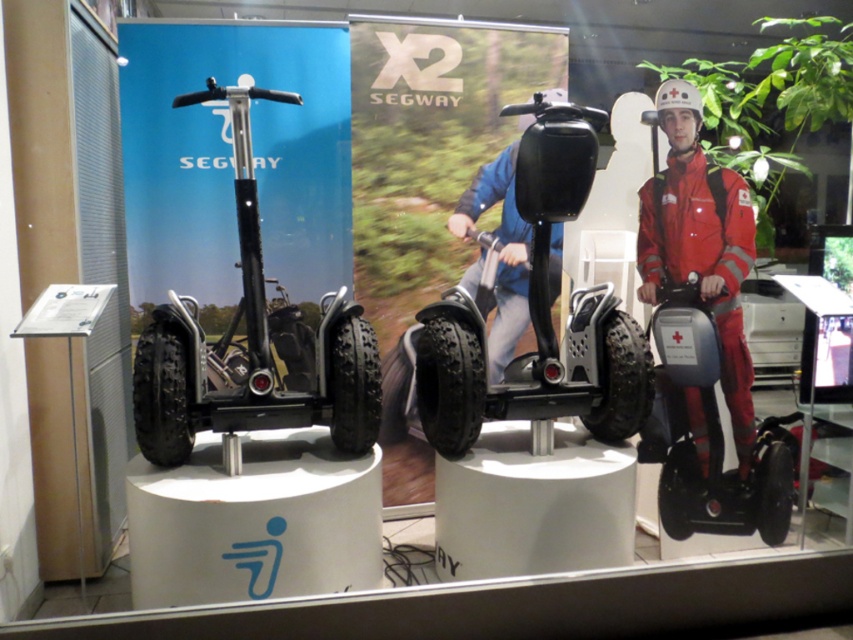
Question: Based on their relative distances, which object is nearer to the matte black scooter at right?

Choices:
 (A) black rubber segway at center
 (B) red matte segway at right
 (C) black matte segway at left

Answer: (B)

Question: Which point appears farthest from the camera in this image?

Choices:
 (A) (239, 104)
 (B) (575, 317)
 (C) (753, 442)
 (D) (643, 188)

Answer: (D)

Question: Which point is closer to the camera?

Choices:
 (A) (732, 180)
 (B) (321, 396)
 (C) (682, 342)
 (D) (535, 419)

Answer: (B)

Question: Is black rubber segway at center positioned behind red matte segway at right?

Choices:
 (A) yes
 (B) no

Answer: (B)

Question: Is black matte segway at left below black rubber segway at center?

Choices:
 (A) no
 (B) yes

Answer: (A)

Question: Is black rubber segway at center smaller than matte black scooter at right?

Choices:
 (A) no
 (B) yes

Answer: (A)